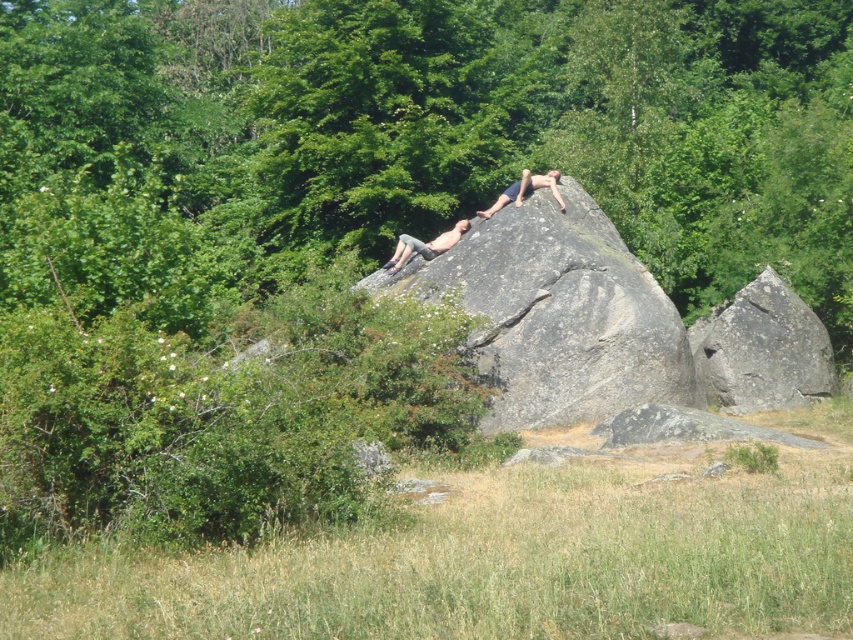
Does smooth gray rock at center have a lesser height compared to skinny jeans at upper center?

Indeed, smooth gray rock at center has a lesser height compared to skinny jeans at upper center.

What do you see at coordinates (422, 246) in the screenshot? I see `smooth gray rock at center` at bounding box center [422, 246].

What do you see at coordinates (422, 246) in the screenshot? I see `smooth gray rock at center` at bounding box center [422, 246].

Image resolution: width=853 pixels, height=640 pixels. I want to click on smooth gray rock at center, so click(x=422, y=246).

Is gray rough rock at center thinner than skinny jeans at upper center?

No.

Is gray rough rock at center taller than skinny jeans at upper center?

Yes.

Is point (467, 260) positioned in front of point (422, 257)?

Yes, it is.

Identify the location of gray rough rock at center. (556, 314).

Is gray rough rock at center below smooth gray rock at center?

Yes, gray rough rock at center is below smooth gray rock at center.

Image resolution: width=853 pixels, height=640 pixels. Identify the location of gray rough rock at center. (556, 314).